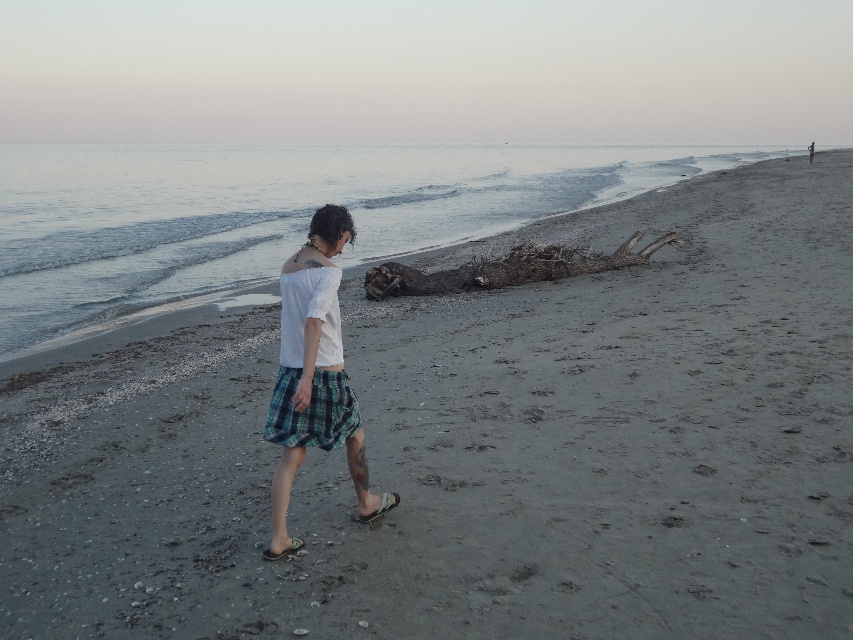
You are standing on the beach and want to walk towards the clear water at upper left without getting your white cotton shirt at center wet. Which direction should you move relative to your current position?

You should move to the right relative to your current position because the clear water at upper left is to the right of the white cotton shirt at center, so moving right will take you toward the water while keeping the shirt away from the water.